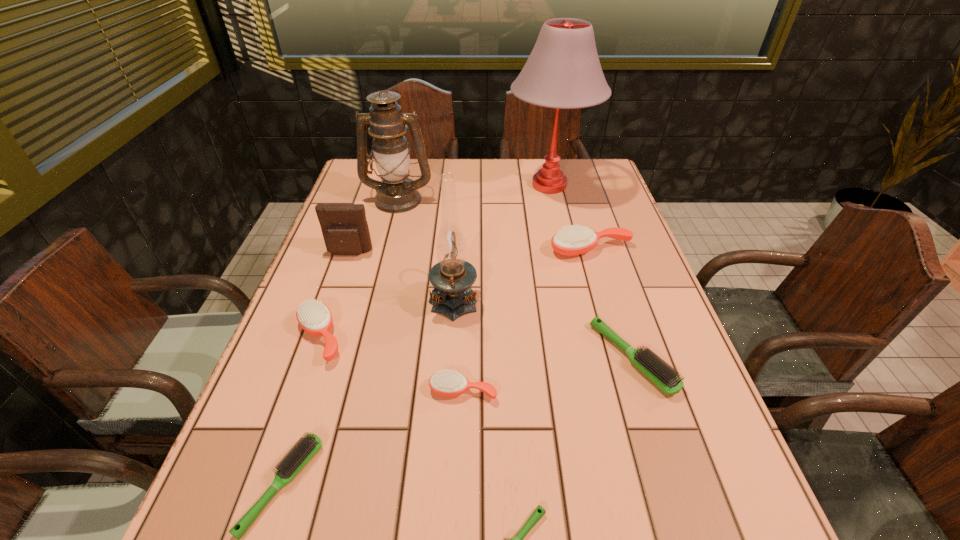
The width and height of the screenshot is (960, 540). Identify the location of the farthest light hairbrush. (659, 372).

Locate an element on the screen. the smallest orange hairbrush is located at coordinates (445, 383).

Locate an element on the screen. This screenshot has height=540, width=960. the nearest orange hairbrush is located at coordinates (445, 383).

Where is `vacant space located 0.060m on the front-facing side of the table lamp`? The width and height of the screenshot is (960, 540). vacant space located 0.060m on the front-facing side of the table lamp is located at coordinates (488, 185).

At what (x,y) coordinates should I click in order to perform the action: click on vacant area located 0.200m on the front-facing side of the table lamp. Please return your answer as a coordinate pair (x, y). The width and height of the screenshot is (960, 540). Looking at the image, I should click on (445, 185).

Where is `free space located 0.060m on the front-facing side of the table lamp`? The width and height of the screenshot is (960, 540). free space located 0.060m on the front-facing side of the table lamp is located at coordinates tap(488, 185).

Find the location of a particular element. This screenshot has height=540, width=960. free space located on the right of the farther oil lamp is located at coordinates (481, 199).

Where is `free space located 0.190m on the left of the right oil lamp`? The height and width of the screenshot is (540, 960). free space located 0.190m on the left of the right oil lamp is located at coordinates point(353,298).

The image size is (960, 540). I want to click on free space located with an open flap on the seventh shortest object, so click(x=322, y=334).

This screenshot has width=960, height=540. What are the coordinates of `vacant space located 0.350m on the left of the sixth shortest object` in the screenshot? It's located at (421, 249).